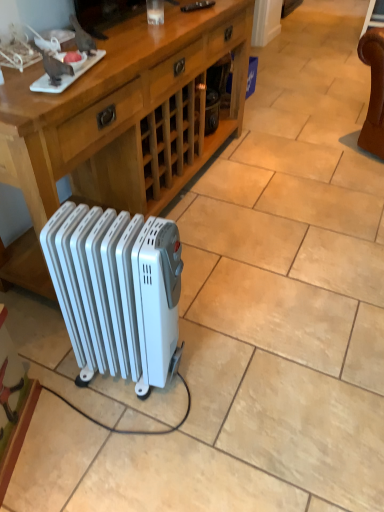
I want to click on vacant space to the right of wooden desk at center, so click(x=283, y=203).